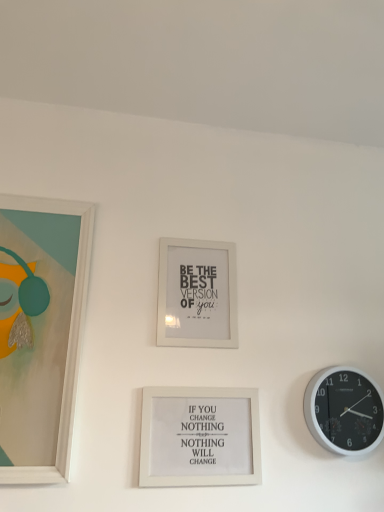
The height and width of the screenshot is (512, 384). Find the location of `white matte picture frame at center, the 2th picture frame from the left`. white matte picture frame at center, the 2th picture frame from the left is located at coordinates (197, 294).

Is black plastic wall clock at right situated inside white matte picture frame at center, the second picture frame in the right-to-left sequence, or outside?

black plastic wall clock at right is not enclosed by white matte picture frame at center, the second picture frame in the right-to-left sequence.

Find the location of a particular element. picture frame behind the black plastic wall clock at right is located at coordinates (197, 294).

Which of these two, black plastic wall clock at right or white matte picture frame at center, the second picture frame in the right-to-left sequence, is bigger?

black plastic wall clock at right is bigger.

From the image's perspective, which is above, white matte picture frame at center, the 2th picture frame from the left, or matte white picture frame at left, the third picture frame positioned from the right?

white matte picture frame at center, the 2th picture frame from the left, from the image's perspective.

Is white matte picture frame at center, the 2th picture frame from the left, taller or shorter than matte white picture frame at left, which appears as the first picture frame when viewed from the left?

Clearly, white matte picture frame at center, the 2th picture frame from the left, is shorter compared to matte white picture frame at left, which appears as the first picture frame when viewed from the left.

Considering the relative positions of white matte picture frame at center, the 2th picture frame from the left, and matte white picture frame at left, which appears as the first picture frame when viewed from the left, in the image provided, is white matte picture frame at center, the 2th picture frame from the left, to the left of matte white picture frame at left, which appears as the first picture frame when viewed from the left, from the viewer's perspective?

In fact, white matte picture frame at center, the 2th picture frame from the left, is to the right of matte white picture frame at left, which appears as the first picture frame when viewed from the left.

Is white matte picture frame at center, the second picture frame in the right-to-left sequence, with matte white picture frame at left, which appears as the first picture frame when viewed from the left?

No.

Would you say black plastic wall clock at right is to the left or to the right of matte white picture frame at left, which appears as the first picture frame when viewed from the left, in the picture?

black plastic wall clock at right is positioned on matte white picture frame at left, which appears as the first picture frame when viewed from the left,'s right side.

From the image's perspective, is black plastic wall clock at right beneath matte white picture frame at left, which appears as the first picture frame when viewed from the left?

Correct, black plastic wall clock at right appears lower than matte white picture frame at left, which appears as the first picture frame when viewed from the left, in the image.

Is black plastic wall clock at right not near matte white picture frame at left, the third picture frame positioned from the right?

black plastic wall clock at right is near matte white picture frame at left, the third picture frame positioned from the right, not far away.

Could you tell me if black plastic wall clock at right is facing white matte picture frame at center, which is counted as the 1th picture frame, starting from the right?

No, black plastic wall clock at right is not oriented towards white matte picture frame at center, which is counted as the 1th picture frame, starting from the right.

Locate an element on the screen. picture frame that appears below the black plastic wall clock at right (from the image's perspective) is located at coordinates (199, 437).

Based on their sizes in the image, would you say black plastic wall clock at right is bigger or smaller than white matte picture frame at center, which is counted as the 1th picture frame, starting from the right?

In the image, black plastic wall clock at right appears to be larger than white matte picture frame at center, which is counted as the 1th picture frame, starting from the right.

Looking at this image, are black plastic wall clock at right and white matte picture frame at center, positioned as the third picture frame in left-to-right order, making contact?

No, black plastic wall clock at right is not making contact with white matte picture frame at center, positioned as the third picture frame in left-to-right order.

Between white matte picture frame at center, the 2th picture frame from the left, and white matte picture frame at center, which is counted as the 1th picture frame, starting from the right, which one appears on the left side from the viewer's perspective?

From the viewer's perspective, white matte picture frame at center, the 2th picture frame from the left, appears more on the left side.

Which of these two, white matte picture frame at center, the 2th picture frame from the left, or white matte picture frame at center, positioned as the third picture frame in left-to-right order, is wider?

white matte picture frame at center, positioned as the third picture frame in left-to-right order, is wider.

From the image's perspective, is white matte picture frame at center, the second picture frame in the right-to-left sequence, over white matte picture frame at center, positioned as the third picture frame in left-to-right order?

Yes, from the image's perspective, white matte picture frame at center, the second picture frame in the right-to-left sequence, is on top of white matte picture frame at center, positioned as the third picture frame in left-to-right order.

Which of these two, white matte picture frame at center, the 2th picture frame from the left, or white matte picture frame at center, positioned as the third picture frame in left-to-right order, is smaller?

white matte picture frame at center, the 2th picture frame from the left, is smaller.

Does white matte picture frame at center, which is counted as the 1th picture frame, starting from the right, have a greater height compared to white matte picture frame at center, the 2th picture frame from the left?

Incorrect, the height of white matte picture frame at center, which is counted as the 1th picture frame, starting from the right, is not larger of that of white matte picture frame at center, the 2th picture frame from the left.

Is white matte picture frame at center, which is counted as the 1th picture frame, starting from the right, oriented away from white matte picture frame at center, the 2th picture frame from the left?

That's not correct — white matte picture frame at center, which is counted as the 1th picture frame, starting from the right, is not looking away from white matte picture frame at center, the 2th picture frame from the left.

From the image's perspective, which is below, white matte picture frame at center, which is counted as the 1th picture frame, starting from the right, or white matte picture frame at center, the second picture frame in the right-to-left sequence?

white matte picture frame at center, which is counted as the 1th picture frame, starting from the right, appears lower in the image.

Does point (191, 441) come farther from viewer compared to point (161, 332)?

No, (191, 441) is closer to viewer.

Can you confirm if matte white picture frame at left, the third picture frame positioned from the right, is wider than white matte picture frame at center, positioned as the third picture frame in left-to-right order?

Indeed, matte white picture frame at left, the third picture frame positioned from the right, has a greater width compared to white matte picture frame at center, positioned as the third picture frame in left-to-right order.

Who is taller, matte white picture frame at left, which appears as the first picture frame when viewed from the left, or white matte picture frame at center, which is counted as the 1th picture frame, starting from the right?

matte white picture frame at left, which appears as the first picture frame when viewed from the left, is taller.

The width and height of the screenshot is (384, 512). Identify the location of the 1st picture frame behind the matte white picture frame at left, the third picture frame positioned from the right. (199, 437).

Can we say matte white picture frame at left, which appears as the first picture frame when viewed from the left, lies outside white matte picture frame at center, which is counted as the 1th picture frame, starting from the right?

That's correct, matte white picture frame at left, which appears as the first picture frame when viewed from the left, is outside of white matte picture frame at center, which is counted as the 1th picture frame, starting from the right.

The image size is (384, 512). I want to click on wall clock lying on the right of white matte picture frame at center, the second picture frame in the right-to-left sequence, so click(344, 410).

Starting from the white matte picture frame at center, the 2th picture frame from the left, which picture frame is the 2nd one in front? Please provide its 2D coordinates.

[(40, 332)]

From the image, which object appears to be nearer to matte white picture frame at left, which appears as the first picture frame when viewed from the left, white matte picture frame at center, the second picture frame in the right-to-left sequence, or white matte picture frame at center, which is counted as the 1th picture frame, starting from the right?

The object closer to matte white picture frame at left, which appears as the first picture frame when viewed from the left, is white matte picture frame at center, the second picture frame in the right-to-left sequence.

Which object lies nearer to the anchor point white matte picture frame at center, positioned as the third picture frame in left-to-right order, black plastic wall clock at right or white matte picture frame at center, the second picture frame in the right-to-left sequence?

white matte picture frame at center, the second picture frame in the right-to-left sequence, is positioned closer to the anchor white matte picture frame at center, positioned as the third picture frame in left-to-right order.

When comparing their distances from black plastic wall clock at right, does white matte picture frame at center, positioned as the third picture frame in left-to-right order, or white matte picture frame at center, the 2th picture frame from the left, seem closer?

white matte picture frame at center, positioned as the third picture frame in left-to-right order, is closer to black plastic wall clock at right.

Considering their positions, is matte white picture frame at left, the third picture frame positioned from the right, positioned closer to black plastic wall clock at right than white matte picture frame at center, which is counted as the 1th picture frame, starting from the right?

Among the two, white matte picture frame at center, which is counted as the 1th picture frame, starting from the right, is located nearer to black plastic wall clock at right.

Considering their positions, is white matte picture frame at center, which is counted as the 1th picture frame, starting from the right, positioned closer to matte white picture frame at left, which appears as the first picture frame when viewed from the left, than white matte picture frame at center, the second picture frame in the right-to-left sequence?

white matte picture frame at center, the second picture frame in the right-to-left sequence, lies closer to matte white picture frame at left, which appears as the first picture frame when viewed from the left, than the other object.

When comparing their distances from white matte picture frame at center, the 2th picture frame from the left, does white matte picture frame at center, positioned as the third picture frame in left-to-right order, or matte white picture frame at left, which appears as the first picture frame when viewed from the left, seem closer?

Based on the image, white matte picture frame at center, positioned as the third picture frame in left-to-right order, appears to be nearer to white matte picture frame at center, the 2th picture frame from the left.

Looking at the image, which one is located further to matte white picture frame at left, which appears as the first picture frame when viewed from the left, black plastic wall clock at right or white matte picture frame at center, the second picture frame in the right-to-left sequence?

Based on the image, black plastic wall clock at right appears to be further to matte white picture frame at left, which appears as the first picture frame when viewed from the left.

Based on their spatial positions, is matte white picture frame at left, which appears as the first picture frame when viewed from the left, or black plastic wall clock at right closer to white matte picture frame at center, which is counted as the 1th picture frame, starting from the right?

black plastic wall clock at right is positioned closer to the anchor white matte picture frame at center, which is counted as the 1th picture frame, starting from the right.

Image resolution: width=384 pixels, height=512 pixels. Find the location of `picture frame situated between white matte picture frame at center, the second picture frame in the right-to-left sequence, and black plastic wall clock at right from left to right`. picture frame situated between white matte picture frame at center, the second picture frame in the right-to-left sequence, and black plastic wall clock at right from left to right is located at coordinates (199, 437).

At what (x,y) coordinates should I click in order to perform the action: click on picture frame between matte white picture frame at left, which appears as the first picture frame when viewed from the left, and white matte picture frame at center, which is counted as the 1th picture frame, starting from the right, from left to right. Please return your answer as a coordinate pair (x, y). Looking at the image, I should click on (197, 294).